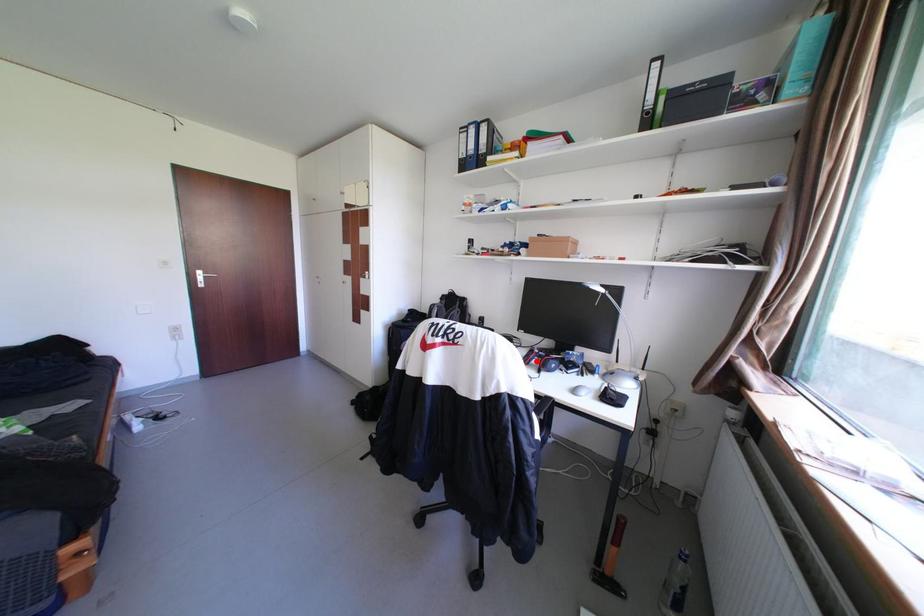
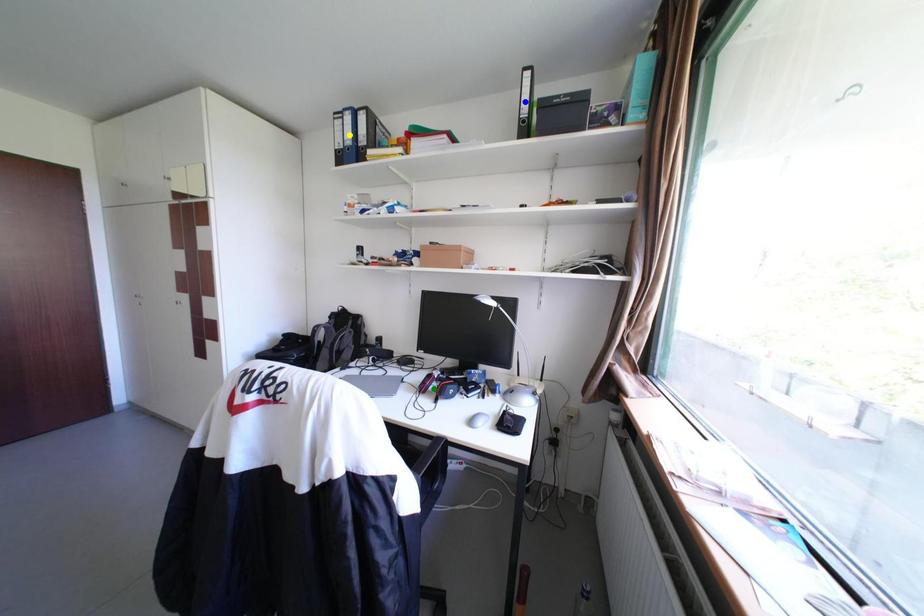
Question: I am providing you with two images of the same scene from different viewpoints. A red point is marked on the first image. You are given multiple points on the second image. Which point in image 2 represents the same 3d spot as the red point in image 1?

Choices:
 (A) green point
 (B) blue point
 (C) yellow point

Answer: (A)